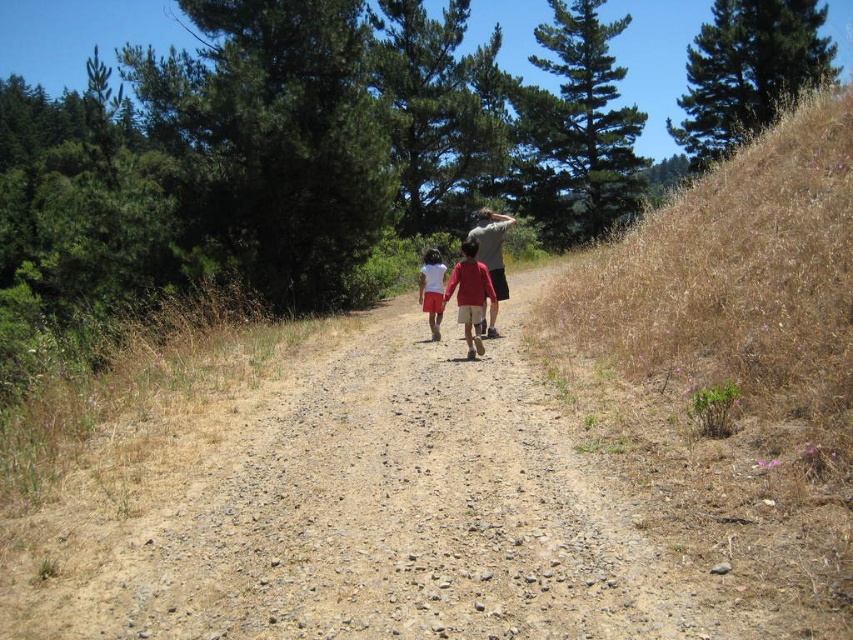
You are standing at the starting point of the dirt path in the forest. You notice two points marked on the path ahead of you. The first point is at coordinates point (x=488, y=326), and the second point is at point (x=421, y=289). Which of these two points is closer to your current position?

Point (x=488, y=326) is closer to the viewer than point (x=421, y=289), so the first point is closer to your current position.

You are a hiker on the dirt path through the forest. You notice two hikers ahead of you wearing a matte red shirt at center and a matte gray shirt at center. Which hiker is closer to you?

The matte red shirt at center is closer to you because it is positioned in front of the matte gray shirt at center.

You are a hiker walking along the dirt path in the forest. You notice a matte red shirt at center and a white matte shorts at center. Which clothing item is closer to you as you walk along the path?

The matte red shirt at center is closer to you because it is in front of the white matte shorts at center along the path.